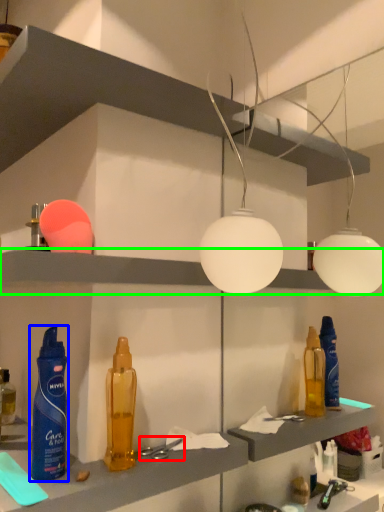
Question: Which is nearer to the tool (highlighted by a red box)? bottle (highlighted by a blue box) or shelf (highlighted by a green box).

Choices:
 (A) bottle
 (B) shelf

Answer: (A)